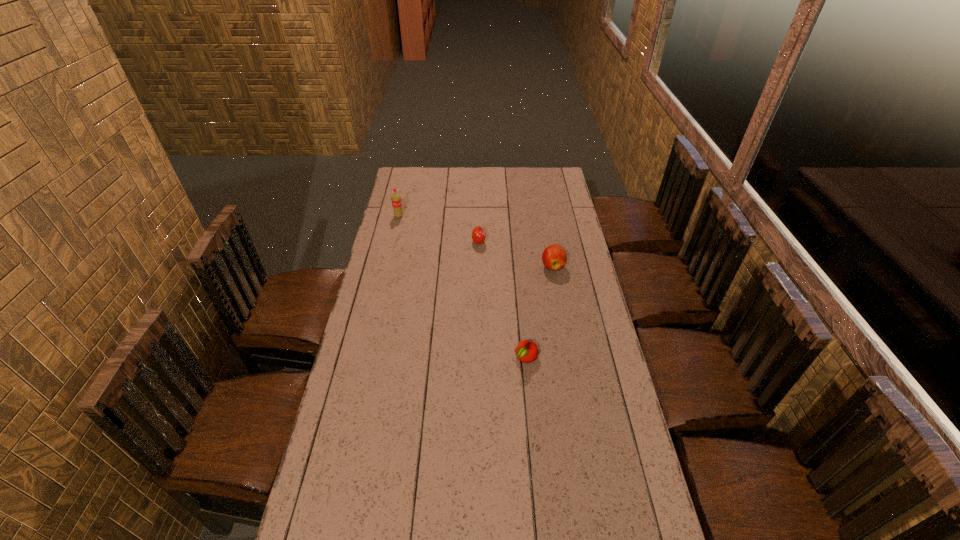
Locate an element on the screen. The width and height of the screenshot is (960, 540). the leftmost object is located at coordinates (396, 199).

Locate an element on the screen. the farthest object is located at coordinates (396, 199).

I want to click on the second nearest object, so click(x=554, y=257).

Identify the location of the tallest apple. (554, 257).

Image resolution: width=960 pixels, height=540 pixels. In order to click on the third nearest object in this screenshot , I will do `click(478, 234)`.

Where is `the third object from right to left`? The height and width of the screenshot is (540, 960). the third object from right to left is located at coordinates (478, 234).

I want to click on the shortest apple, so click(x=526, y=351).

Identify the location of the nearest apple. Image resolution: width=960 pixels, height=540 pixels. (526, 351).

Where is `vacant space located on the front of the farthest object`? This screenshot has height=540, width=960. vacant space located on the front of the farthest object is located at coordinates (387, 267).

This screenshot has height=540, width=960. Identify the location of free space located 0.270m on the back of the third farthest object. (545, 221).